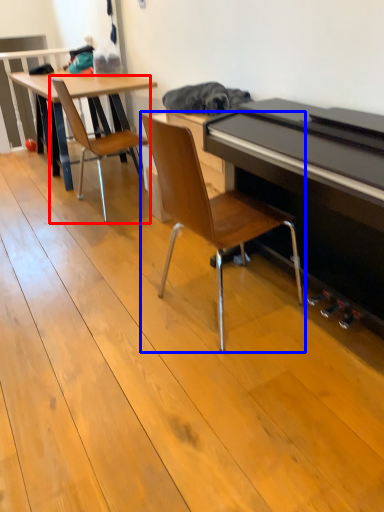
Question: Which point is further to the camera, chair (highlighted by a red box) or chair (highlighted by a blue box)?

Choices:
 (A) chair
 (B) chair

Answer: (A)